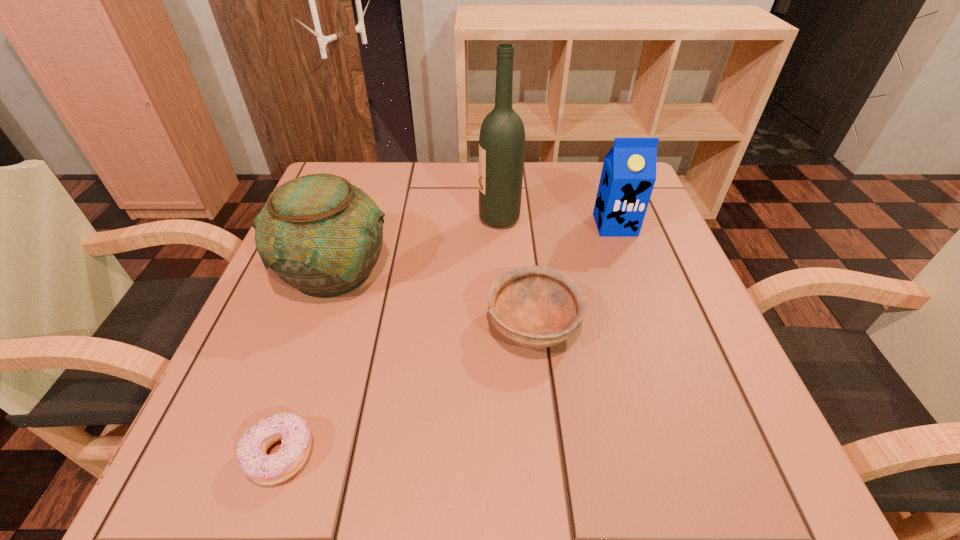
I want to click on vacant space located 0.140m on the front of the pottery, so click(x=294, y=385).

Identify the location of blank area located on the left of the bowl. The height and width of the screenshot is (540, 960). [x=382, y=324].

Image resolution: width=960 pixels, height=540 pixels. In order to click on vacant space situated 0.070m on the back of the shortest object in this screenshot , I will do `click(305, 381)`.

At what (x,y) coordinates should I click in order to perform the action: click on wine bottle that is at the far edge. Please return your answer as a coordinate pair (x, y). This screenshot has height=540, width=960. Looking at the image, I should click on tap(502, 135).

This screenshot has height=540, width=960. What are the coordinates of `carton located in the far edge section of the desktop` in the screenshot? It's located at (628, 176).

Where is `object that is at the near edge`? The image size is (960, 540). object that is at the near edge is located at coordinates (293, 430).

At what (x,y) coordinates should I click in order to perform the action: click on pottery that is positioned at the left edge. Please return your answer as a coordinate pair (x, y). Looking at the image, I should click on (319, 233).

Where is `doughnut that is at the left edge`? Image resolution: width=960 pixels, height=540 pixels. doughnut that is at the left edge is located at coordinates (293, 430).

The height and width of the screenshot is (540, 960). What are the coordinates of `object situated at the right edge` in the screenshot? It's located at (628, 176).

Locate an element on the screen. The width and height of the screenshot is (960, 540). object at the near left corner is located at coordinates (293, 430).